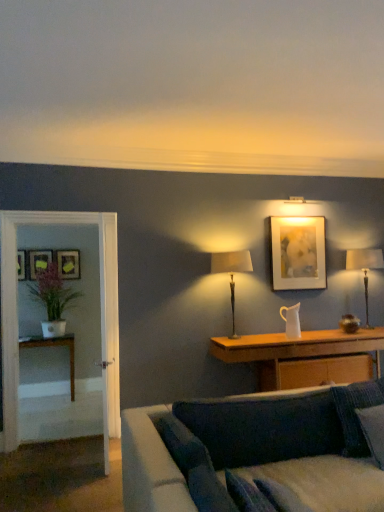
Question: Is white glossy table at left, the first table viewed from the back, taller than dark blue fabric pillow at lower right?

Choices:
 (A) yes
 (B) no

Answer: (A)

Question: From the image's perspective, is white glossy table at left, the first table viewed from the back, below dark blue fabric pillow at lower right?

Choices:
 (A) yes
 (B) no

Answer: (A)

Question: Is dark blue fabric pillow at lower right located within white glossy table at left, the second table positioned from the front?

Choices:
 (A) yes
 (B) no

Answer: (B)

Question: Is dark blue fabric pillow at lower right at the back of white glossy table at left, the second table positioned from the front?

Choices:
 (A) yes
 (B) no

Answer: (B)

Question: Considering the relative sizes of white glossy table at left, the first table viewed from the back, and dark blue fabric pillow at lower right in the image provided, is white glossy table at left, the first table viewed from the back, thinner than dark blue fabric pillow at lower right?

Choices:
 (A) yes
 (B) no

Answer: (B)

Question: Visually, is green matte plant at left positioned to the left or to the right of velvet dark blue couch at lower center?

Choices:
 (A) right
 (B) left

Answer: (B)

Question: From the image's perspective, is green matte plant at left positioned above or below velvet dark blue couch at lower center?

Choices:
 (A) above
 (B) below

Answer: (A)

Question: Is point (51, 290) positioned closer to the camera than point (226, 501)?

Choices:
 (A) farther
 (B) closer

Answer: (A)

Question: From a real-world perspective, relative to velvet dark blue couch at lower center, is green matte plant at left vertically above or below?

Choices:
 (A) above
 (B) below

Answer: (A)

Question: Relative to metallic gold table lamp at right, which is counted as the first table lamp, starting from the back, is matte black picture frame at left, which is the second picture frame from front to back, in front or behind?

Choices:
 (A) front
 (B) behind

Answer: (B)

Question: From a real-world perspective, is matte black picture frame at left, the 1th picture frame in the left-to-right sequence, positioned above or below metallic gold table lamp at right, placed as the second table lamp when sorted from front to back?

Choices:
 (A) below
 (B) above

Answer: (B)

Question: Visually, is matte black picture frame at left, which appears as the third picture frame when viewed from the back, positioned to the left or to the right of metallic gold table lamp at right, which is the second table lamp in left-to-right order?

Choices:
 (A) right
 (B) left

Answer: (B)

Question: Is matte black picture frame at left, the fourth picture frame viewed from the right, taller or shorter than metallic gold table lamp at right, which is the second table lamp in left-to-right order?

Choices:
 (A) tall
 (B) short

Answer: (B)

Question: From a real-world perspective, relative to clear glass door at left, is matte black picture frame at left, the 1th picture frame in the left-to-right sequence, vertically above or below?

Choices:
 (A) below
 (B) above

Answer: (B)

Question: Considering their positions, is matte black picture frame at left, which is the second picture frame from front to back, located in front of or behind clear glass door at left?

Choices:
 (A) behind
 (B) front

Answer: (A)